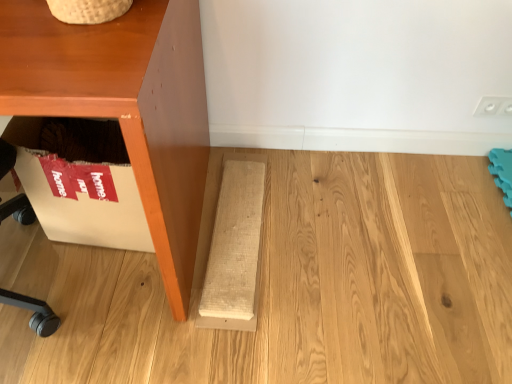
Where is `free space above natural wood plank at lower center (from a real-world perspective)`? free space above natural wood plank at lower center (from a real-world perspective) is located at coordinates (228, 237).